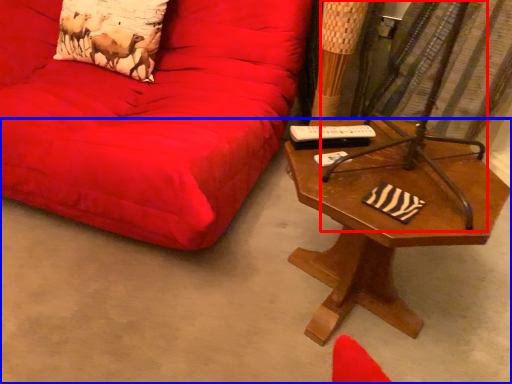
Question: Which object is further to the camera taking this photo, swivel chair (highlighted by a red box) or concrete (highlighted by a blue box)?

Choices:
 (A) swivel chair
 (B) concrete

Answer: (A)